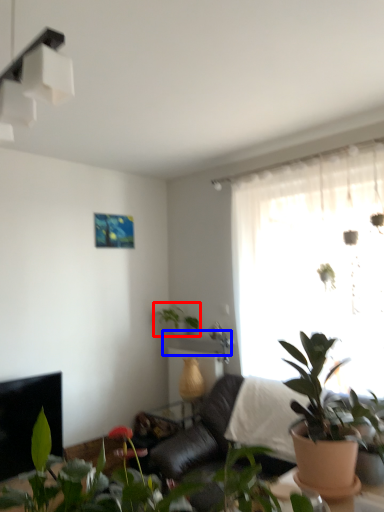
Question: Which object is closer to the camera taking this photo, houseplant (highlighted by a red box) or window sill (highlighted by a blue box)?

Choices:
 (A) houseplant
 (B) window sill

Answer: (B)